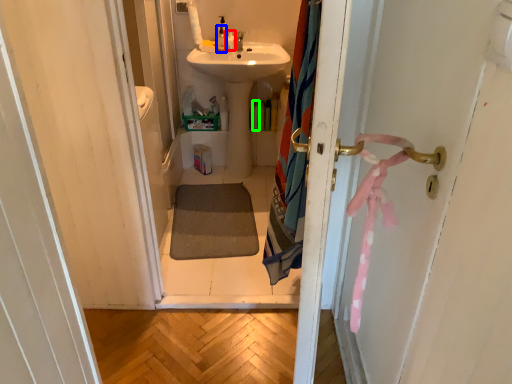
Question: Which is nearer to the toiletry (highlighted by a red box)? toiletry (highlighted by a blue box) or toiletry (highlighted by a green box).

Choices:
 (A) toiletry
 (B) toiletry

Answer: (A)